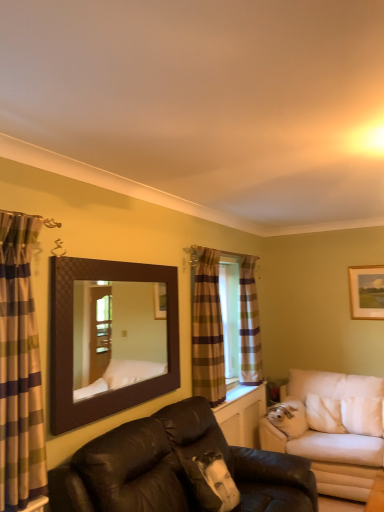
Question: From a real-world perspective, is leather couch at center, which ranks as the 2th studio couch in back-to-front order, physically located above or below brown textured mirror at upper center?

Choices:
 (A) below
 (B) above

Answer: (A)

Question: From the image's perspective, relative to brown textured mirror at upper center, is leather couch at center, which ranks as the 2th studio couch in back-to-front order, above or below?

Choices:
 (A) above
 (B) below

Answer: (B)

Question: Which of these objects is positioned closest to the leather couch at center, which is the 1th studio couch in front-to-back order?

Choices:
 (A) plaid fabric curtain at left, arranged as the first curtain when viewed from the front
 (B) plaid fabric curtain at center, which ranks as the second curtain in back-to-front order
 (C) wooden framed picture at upper right
 (D) white fabric studio couch at right, acting as the 2th studio couch starting from the front
 (E) plaid fabric curtain at window, arranged as the 1th curtain when viewed from the back

Answer: (B)

Question: Which object is the farthest from the plaid fabric curtain at window, the third curtain in the front-to-back sequence?

Choices:
 (A) plaid fabric curtain at left, arranged as the first curtain when viewed from the front
 (B) leather couch at center, which is counted as the 1th studio couch, starting from the left
 (C) wooden framed picture at upper right
 (D) plaid fabric curtain at center, placed as the second curtain when sorted from right to left
 (E) white fabric studio couch at right, which ranks as the 2th studio couch in left-to-right order

Answer: (A)